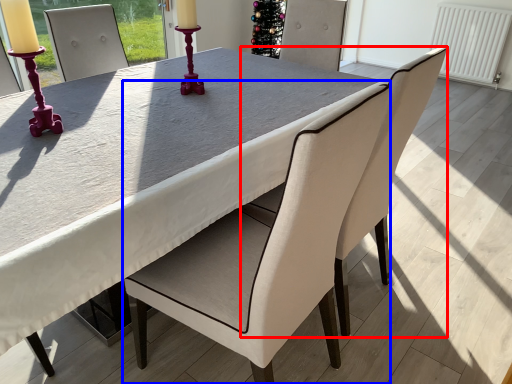
Question: Which object appears closest to the camera in this image, chair (highlighted by a red box) or chair (highlighted by a blue box)?

Choices:
 (A) chair
 (B) chair

Answer: (B)